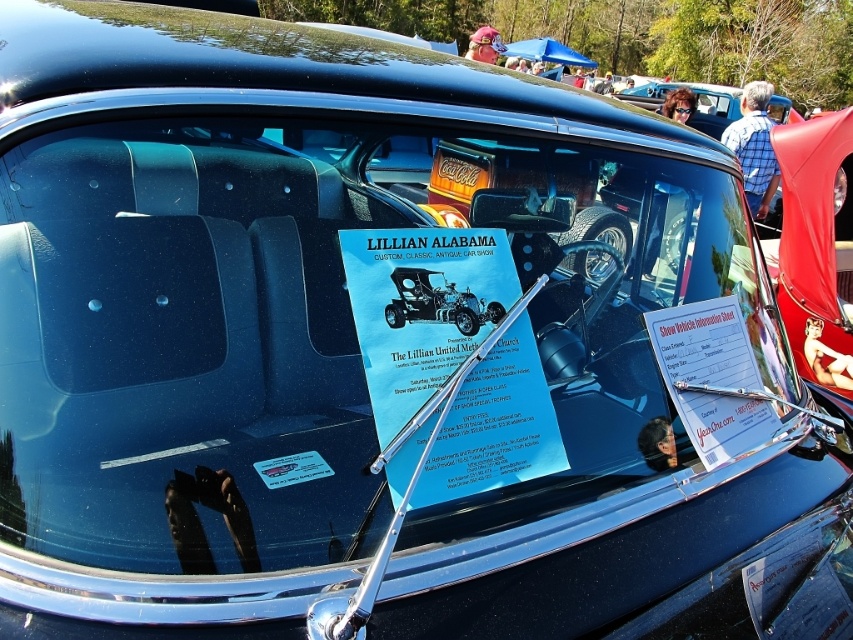
Question: Which point is farther to the camera?

Choices:
 (A) (810, 349)
 (B) (743, 84)
 (C) (670, 100)
 (D) (674, 438)

Answer: (B)

Question: Which of the following is the closest to the observer?

Choices:
 (A) (767, 138)
 (B) (485, 58)
 (C) (669, 93)
 (D) (651, 422)

Answer: (D)

Question: Is pink fabric hat at upper center to the left of smooth brown hair at upper center from the viewer's perspective?

Choices:
 (A) yes
 (B) no

Answer: (A)

Question: Which object is positioned closest to the smooth brown hair at upper center?

Choices:
 (A) pink fabric hat at upper center
 (B) dark hair at center

Answer: (B)

Question: Does dark hair at center have a lesser width compared to pink fabric hat at upper center?

Choices:
 (A) yes
 (B) no

Answer: (A)

Question: Observing the image, what is the correct spatial positioning of reddish-brown leather bikini at center in reference to pink fabric hat at upper center?

Choices:
 (A) below
 (B) above

Answer: (A)